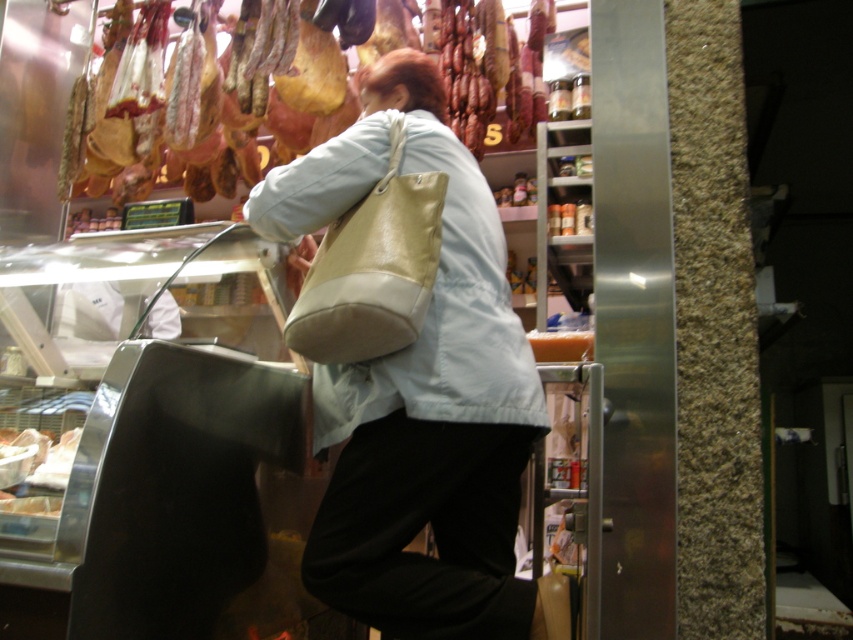
In the scene shown: You are standing in the deli and need to determine the relative positions of two points in the scene. The first point is at coordinates point (405,112), and the second point is at point (96,168). Which point is closer to you?

Point (405,112) is closer to the viewer than point (96,168).

You are a customer in a deli holding a 1.5 meter long pole. You need to reach both the matte brown cured meat at upper left and the white glossy cheese at lower left. Can you reach both items with your pole without moving it?

The distance between the matte brown cured meat at upper left and the white glossy cheese at lower left is 1.47 meters. Since your pole is 1.5 meters long, it is just long enough to reach both items without moving the pole.

You are a customer in the deli and want to place the white glossy cheese at lower left into the beige leather bag at center. Can the cheese fit inside the bag?

The beige leather bag at center might be wider than white glossy cheese at lower left, so there is a possibility that the cheese can fit inside the bag, but it is uncertain due to the word might in the description.